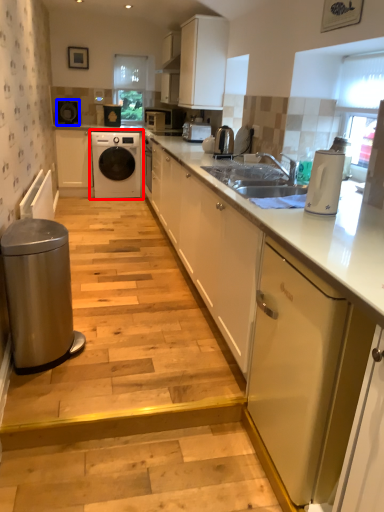
Question: Among these objects, which one is nearest to the camera, washing machine (highlighted by a red box) or appliance (highlighted by a blue box)?

Choices:
 (A) washing machine
 (B) appliance

Answer: (B)